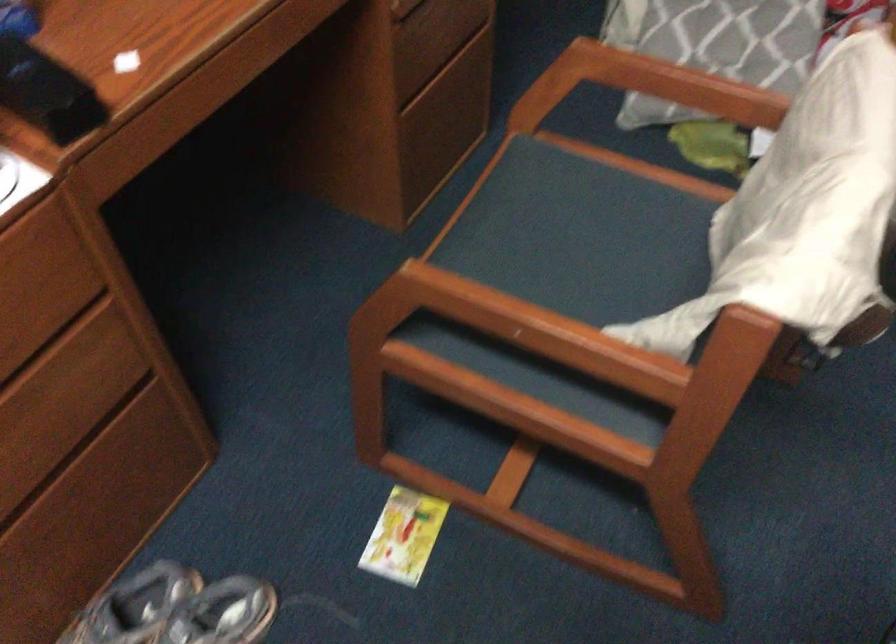
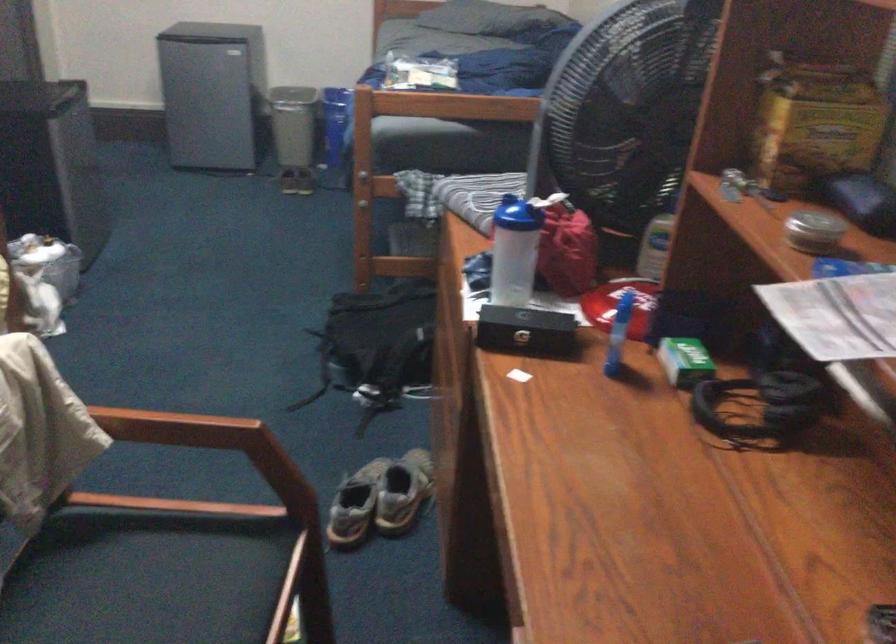
Where in the second image is the point corresponding to the point at 519,296 from the first image?

(176, 428)